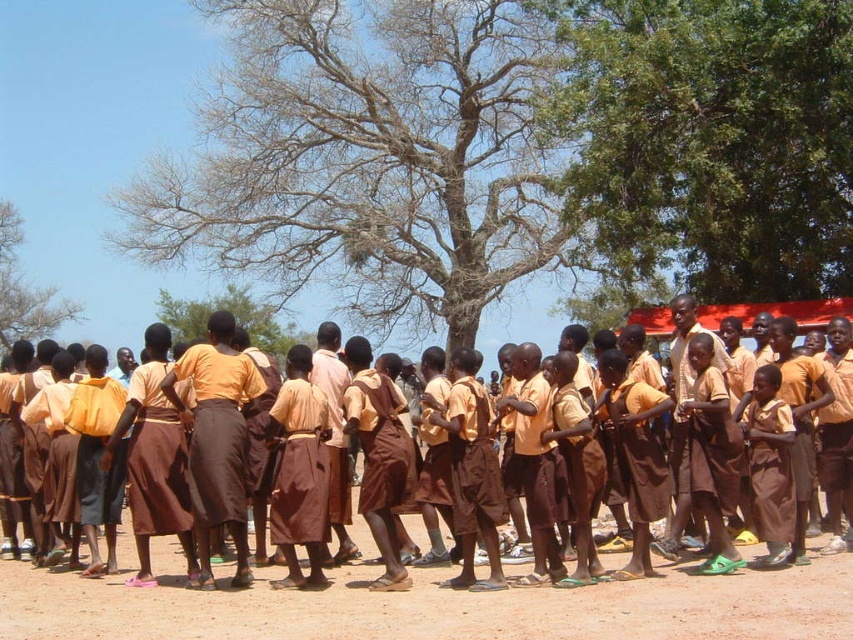
Is green leafy tree at upper right to the right of brown fabric skirt at lower right from the viewer's perspective?

Correct, you'll find green leafy tree at upper right to the right of brown fabric skirt at lower right.

Between green leafy tree at upper right and brown fabric skirt at lower right, which one is positioned higher?

green leafy tree at upper right is above.

Who is more forward, (665, 236) or (763, 376)?

Point (763, 376) is in front.

Image resolution: width=853 pixels, height=640 pixels. In order to click on green leafy tree at upper right in this screenshot , I will do `click(711, 141)`.

Who is more distant from viewer, (607,1) or (631,404)?

Point (607,1)

Is green leafy tree at upper right wider than brown fabric skirt at center?

Correct, the width of green leafy tree at upper right exceeds that of brown fabric skirt at center.

Who is more forward, (x=752, y=20) or (x=759, y=508)?

Point (x=759, y=508) is in front.

This screenshot has width=853, height=640. I want to click on green leafy tree at upper right, so click(x=711, y=141).

Does green leafy tree at center appear under brown fabric skirt at center?

→ No.

Can you confirm if green leafy tree at center is wider than brown fabric skirt at center?

Yes.

Is point (270, 342) positioned behind point (775, 412)?

Yes, it is behind point (775, 412).

What are the coordinates of `green leafy tree at center` in the screenshot? It's located at (234, 316).